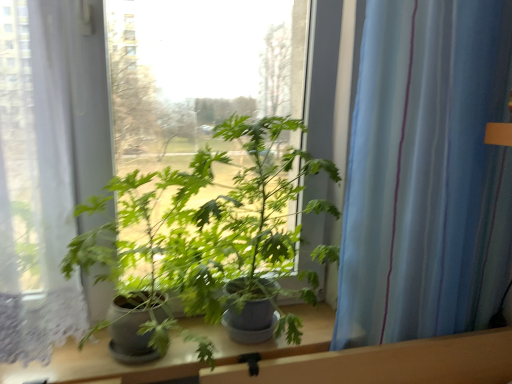
Question: From a real-world perspective, is blue striped curtain at right above or below green matte plant at center?

Choices:
 (A) below
 (B) above

Answer: (B)

Question: Based on their sizes in the image, would you say blue striped curtain at right is bigger or smaller than green matte plant at center?

Choices:
 (A) small
 (B) big

Answer: (A)

Question: Is point (483, 19) closer or farther from the camera than point (252, 294)?

Choices:
 (A) closer
 (B) farther

Answer: (A)

Question: Is green matte plant at center wider or thinner than blue striped curtain at right?

Choices:
 (A) thin
 (B) wide

Answer: (B)

Question: Is green matte plant at center situated inside blue striped curtain at right or outside?

Choices:
 (A) inside
 (B) outside

Answer: (B)

Question: From the image's perspective, relative to blue striped curtain at right, is green matte plant at center above or below?

Choices:
 (A) above
 (B) below

Answer: (B)

Question: Looking at the image, does green matte plant at center seem bigger or smaller compared to blue striped curtain at right?

Choices:
 (A) small
 (B) big

Answer: (B)